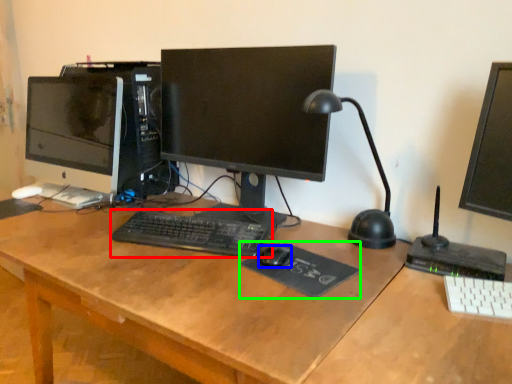
Question: Estimate the real-world distances between objects in this image. Which object is farther from computer keyboard (highlighted by a red box), mouse (highlighted by a blue box) or mousepad (highlighted by a green box)?

Choices:
 (A) mouse
 (B) mousepad

Answer: (A)